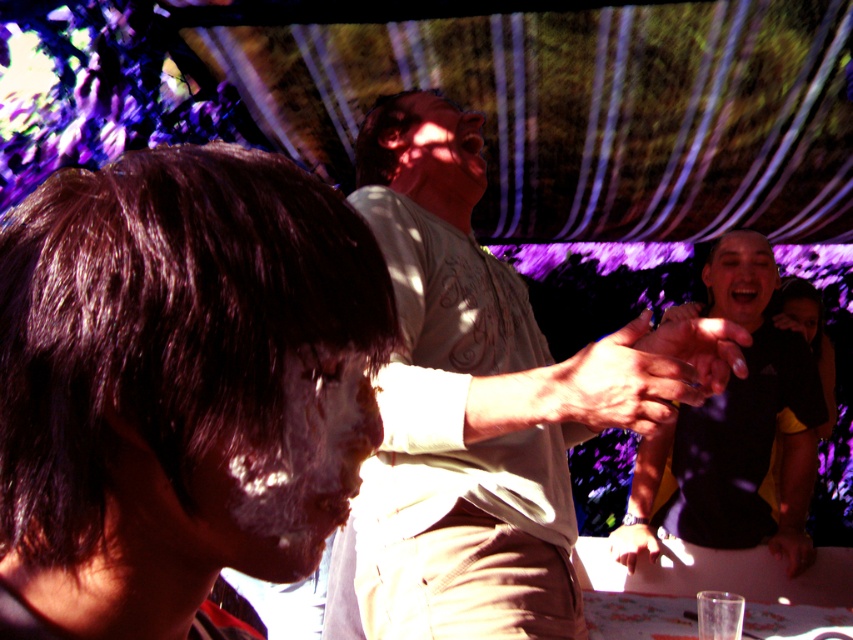
Question: Which is farther from the white matte face paint at center?

Choices:
 (A) smooth skin hand at center
 (B) black matte shirt at right
 (C) light beige shirt at center
 (D) clear plastic ring at center

Answer: (A)

Question: Which object is the closest to the white matte face paint at center?

Choices:
 (A) smooth skin hand at center
 (B) black matte shirt at right
 (C) light beige shirt at center
 (D) clear plastic ring at center

Answer: (D)

Question: Does white matte face paint at center appear over clear plastic ring at center?

Choices:
 (A) no
 (B) yes

Answer: (A)

Question: Does white matte face paint at center have a smaller size compared to smooth skin hand at center?

Choices:
 (A) yes
 (B) no

Answer: (B)

Question: Which of the following is the closest to the observer?

Choices:
 (A) clear plastic ring at center
 (B) smooth skin hand at center
 (C) black matte shirt at right

Answer: (A)

Question: Is light beige shirt at center bigger than smooth skin hand at center?

Choices:
 (A) no
 (B) yes

Answer: (B)